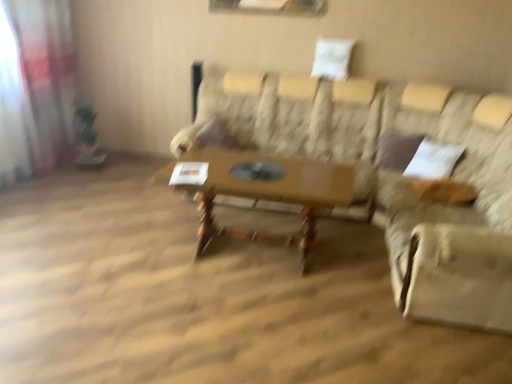
Question: Should I look upward or downward to see wooden table at center?

Choices:
 (A) up
 (B) down

Answer: (B)

Question: Does patterned fabric couch at center lie behind beige fabric swivel chair at right?

Choices:
 (A) no
 (B) yes

Answer: (A)

Question: Is patterned fabric couch at center closer to camera compared to beige fabric swivel chair at right?

Choices:
 (A) yes
 (B) no

Answer: (A)

Question: From the image's perspective, is patterned fabric couch at center below beige fabric swivel chair at right?

Choices:
 (A) no
 (B) yes

Answer: (A)

Question: Is patterned fabric couch at center at the right side of beige fabric swivel chair at right?

Choices:
 (A) yes
 (B) no

Answer: (B)

Question: From a real-world perspective, is patterned fabric couch at center on beige fabric swivel chair at right?

Choices:
 (A) no
 (B) yes

Answer: (A)

Question: Is patterned fabric couch at center to the left of beige fabric swivel chair at right from the viewer's perspective?

Choices:
 (A) no
 (B) yes

Answer: (B)

Question: From the image's perspective, is wooden table at center on top of patterned fabric couch at center?

Choices:
 (A) yes
 (B) no

Answer: (B)

Question: Can you confirm if wooden table at center is wider than patterned fabric couch at center?

Choices:
 (A) yes
 (B) no

Answer: (B)

Question: Would you say wooden table at center is outside patterned fabric couch at center?

Choices:
 (A) yes
 (B) no

Answer: (B)

Question: Considering the relative positions of wooden table at center and patterned fabric couch at center in the image provided, is wooden table at center to the left of patterned fabric couch at center from the viewer's perspective?

Choices:
 (A) no
 (B) yes

Answer: (B)

Question: Would you consider wooden table at center to be distant from patterned fabric couch at center?

Choices:
 (A) no
 (B) yes

Answer: (A)

Question: Is wooden table at center with patterned fabric couch at center?

Choices:
 (A) yes
 (B) no

Answer: (B)

Question: Does patterned fabric couch at center appear on the right side of translucent fabric curtain at left?

Choices:
 (A) yes
 (B) no

Answer: (A)